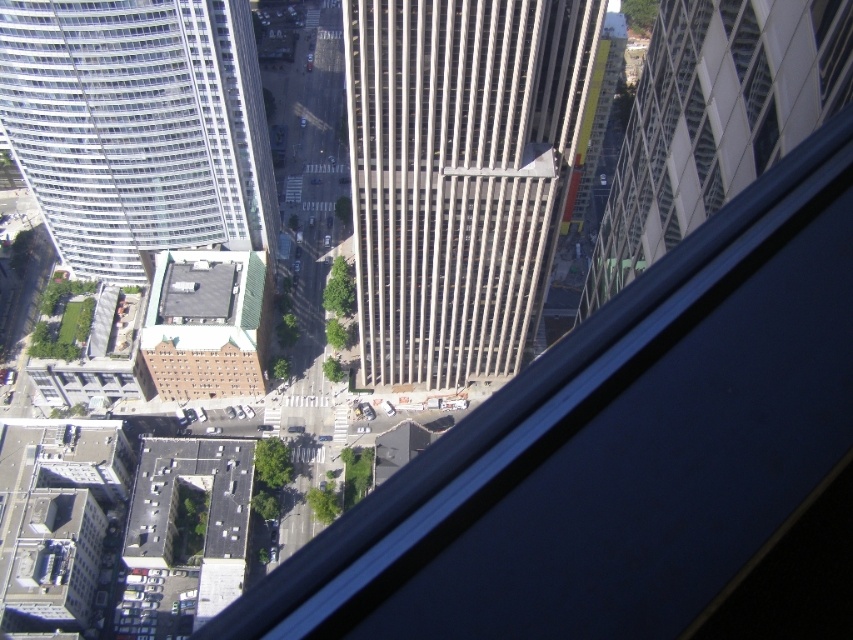
Question: Among these points, which one is nearest to the camera?

Choices:
 (A) (410, 38)
 (B) (221, 97)

Answer: (A)

Question: Among these objects, which one is farthest from the camera?

Choices:
 (A) gray concrete skyscraper at center
 (B) white glass building at upper left

Answer: (B)

Question: Can you confirm if gray concrete skyscraper at center is bigger than white glass building at upper left?

Choices:
 (A) yes
 (B) no

Answer: (A)

Question: Can you confirm if gray concrete skyscraper at center is positioned below white glass building at upper left?

Choices:
 (A) no
 (B) yes

Answer: (B)

Question: Which object appears closest to the camera in this image?

Choices:
 (A) gray concrete skyscraper at center
 (B) white glass building at upper left

Answer: (A)

Question: Can you confirm if gray concrete skyscraper at center is wider than white glass building at upper left?

Choices:
 (A) no
 (B) yes

Answer: (A)